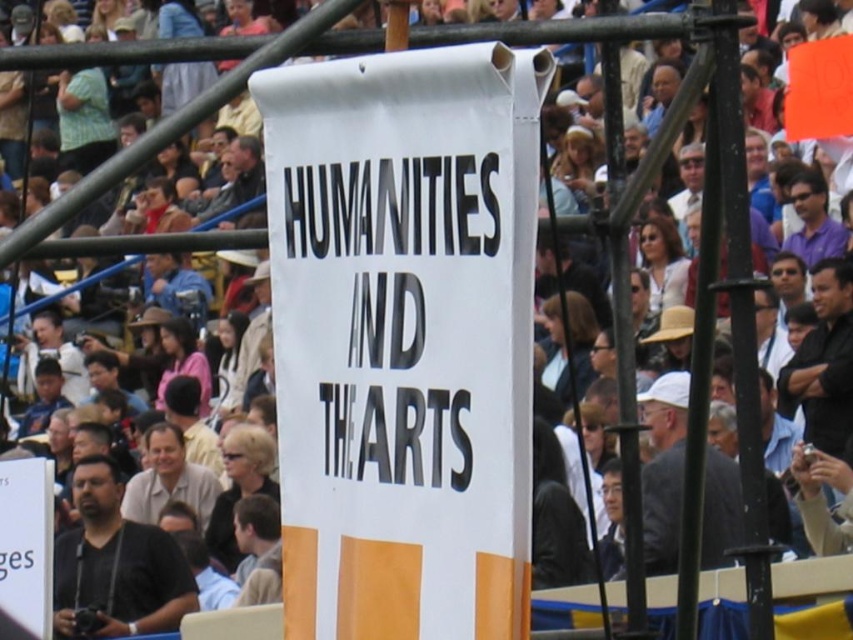
Who is taller, dark gray suit at center or black leather jacket at right?

Standing taller between the two is dark gray suit at center.

I want to click on dark gray suit at center, so click(663, 470).

Who is positioned more to the left, white paper banner at center or black leather jacket at right?

From the viewer's perspective, white paper banner at center appears more on the left side.

Who is more forward, [341,476] or [846,292]?

Positioned in front is point [341,476].

Identify the location of white paper banner at center. (404, 339).

Where is `white paper banner at center`? Image resolution: width=853 pixels, height=640 pixels. white paper banner at center is located at coordinates (404, 339).

In the scene shown: Can you confirm if white paper banner at center is positioned to the right of dark gray suit at center?

No, white paper banner at center is not to the right of dark gray suit at center.

Consider the image. Does white paper banner at center have a greater width compared to dark gray suit at center?

In fact, white paper banner at center might be narrower than dark gray suit at center.

Identify the location of white paper banner at center. point(404,339).